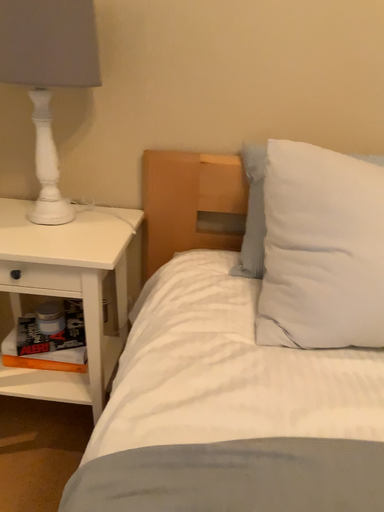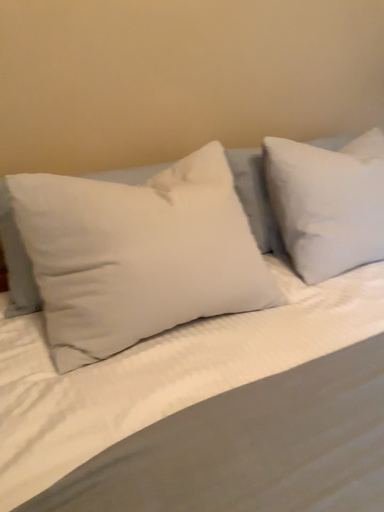
Question: How did the camera likely rotate when shooting the video?

Choices:
 (A) rotated upward
 (B) rotated downward

Answer: (A)